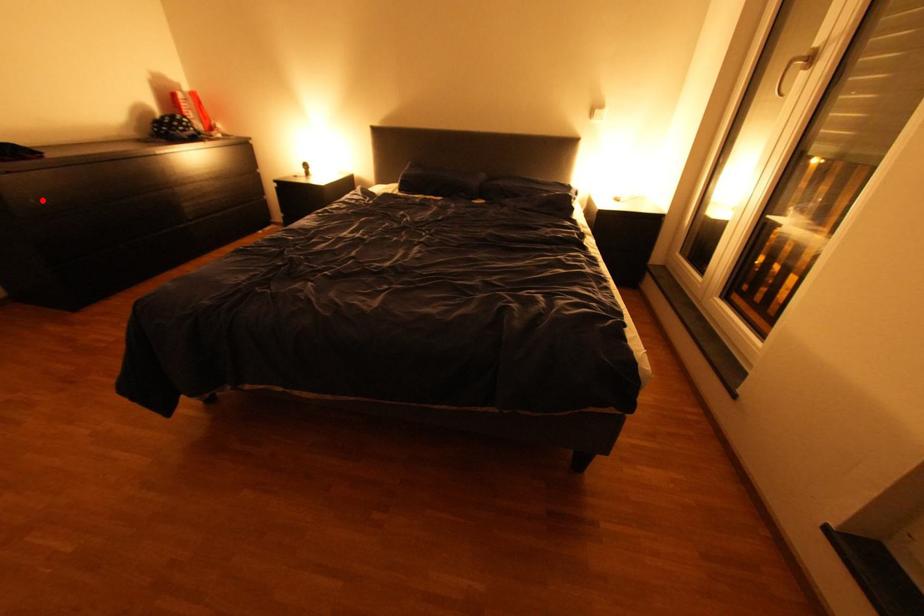
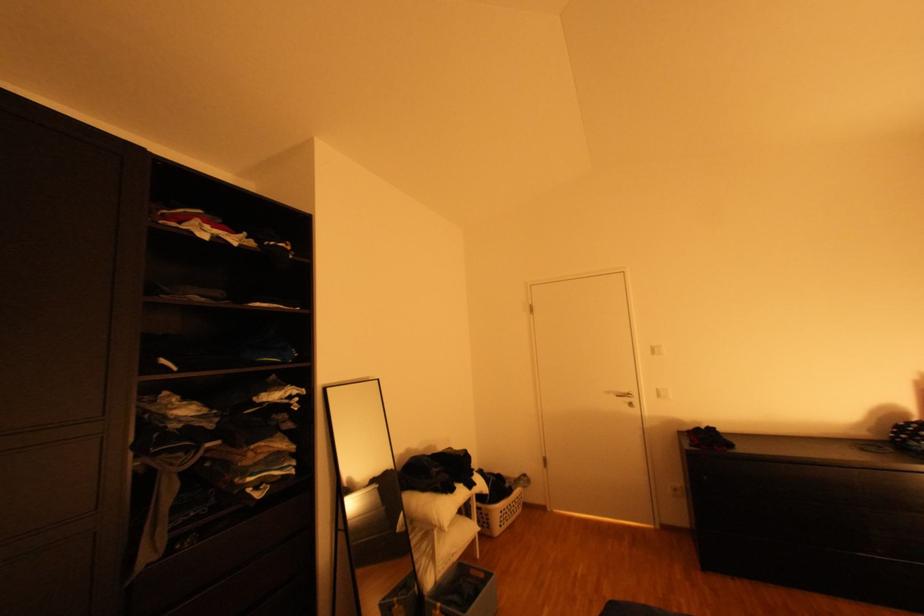
Question: I am providing you with two images of the same scene from different viewpoints. Given a red point in image1, look at the same physical point in image2. Is it:

Choices:
 (A) Closer to the viewpoint
 (B) Farther from the viewpoint

Answer: (A)